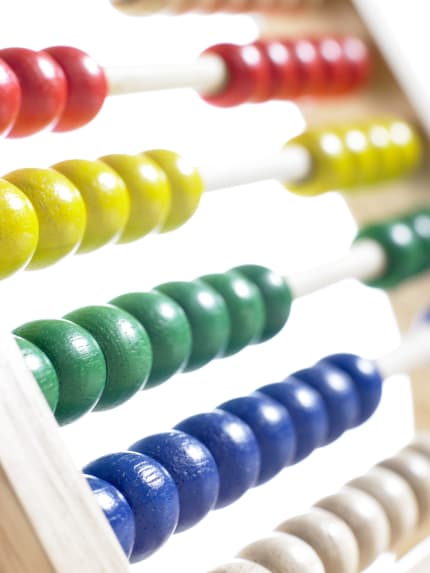
Image resolution: width=430 pixels, height=573 pixels. What are the coordinates of `blue abacus beads` in the screenshot? It's located at (119, 520), (155, 500), (205, 476), (248, 461), (282, 439), (318, 417), (345, 398), (369, 384), (427, 320).